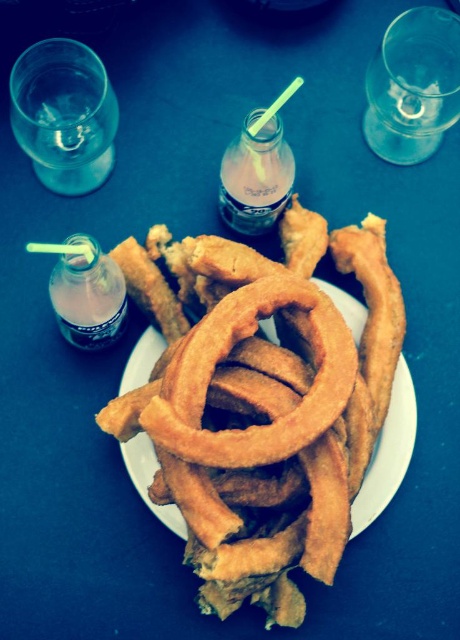
Please describe the position of the golden crispy onion rings at center in terms of coordinates based on the image frame. The image frame has a coordinate system where the bottom left corner is the origin point. The x and y axes are normalized between 0 and 1. The answer should include the exact coordinates provided in the description.

The golden crispy onion rings at center are located at coordinates point (262, 403) in the image frame.